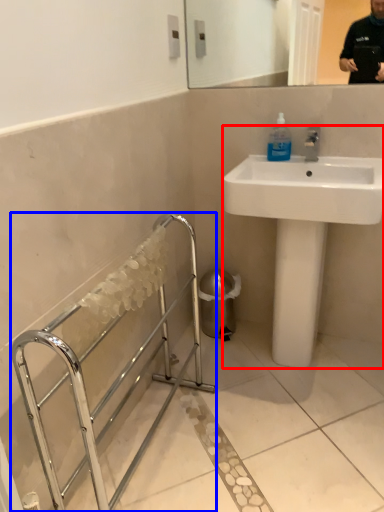
Question: Among these objects, which one is farthest to the camera, sink (highlighted by a red box) or balustrade (highlighted by a blue box)?

Choices:
 (A) sink
 (B) balustrade

Answer: (A)